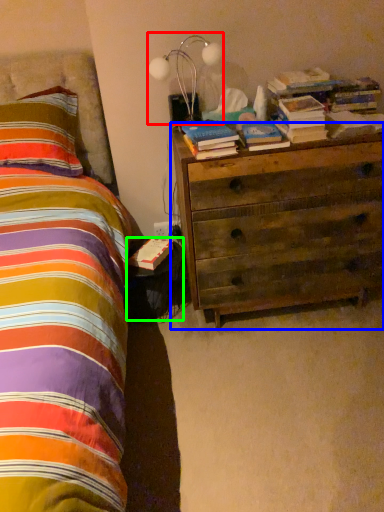
Question: Which is nearer to the lamp (highlighted by a red box)? chest of drawers (highlighted by a blue box) or nightstand (highlighted by a green box).

Choices:
 (A) chest of drawers
 (B) nightstand

Answer: (A)